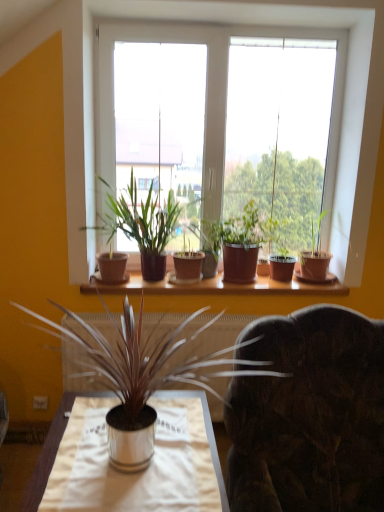
Question: Is point (218, 233) closer or farther from the camera than point (57, 335)?

Choices:
 (A) closer
 (B) farther

Answer: (B)

Question: Is terracotta pot at center, marked as the fifth houseplant in a front-to-back arrangement, wider or thinner than silver metallic vase at center, the 1th houseplant when ordered from front to back?

Choices:
 (A) wide
 (B) thin

Answer: (B)

Question: Which of these objects is positioned closest to the white plastic window at center?

Choices:
 (A) green matte plant at upper right, which appears as the second houseplant when viewed from the back
 (B) matte brown pot at center, the 3th houseplant in the front-to-back sequence
 (C) dark brown leather swivel chair at center
 (D) brown clay pot at center, the fourth houseplant viewed from the back
 (E) terracotta pot at center, marked as the fifth houseplant in a front-to-back arrangement

Answer: (D)

Question: Which object is positioned closest to the dark brown leather swivel chair at center?

Choices:
 (A) white plastic window at center
 (B) matte brown pot at center, the third houseplant viewed from the back
 (C) metallic silver table at lower center
 (D) silver metallic vase at center, the 1th houseplant when ordered from front to back
 (E) terracotta pot at center, which is the first houseplant in back-to-front order

Answer: (D)